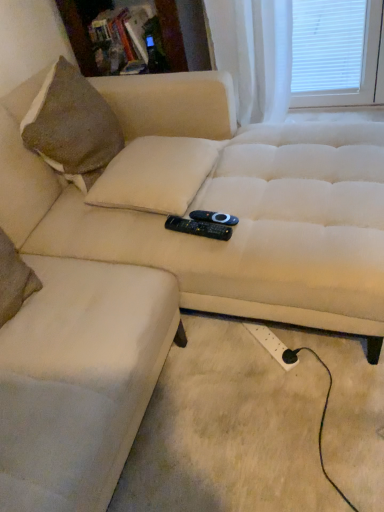
Question: Is black plastic remote at center, the second remote from the top, closer to camera compared to white plastic extension cord at lower right?

Choices:
 (A) yes
 (B) no

Answer: (A)

Question: Is black plastic remote at center, which ranks as the 1th remote in bottom-to-top order, taller than white plastic extension cord at lower right?

Choices:
 (A) yes
 (B) no

Answer: (B)

Question: Is black plastic remote at center, the second remote from the top, looking in the opposite direction of white plastic extension cord at lower right?

Choices:
 (A) no
 (B) yes

Answer: (A)

Question: From the image's perspective, would you say black plastic remote at center, the second remote from the top, is positioned over white plastic extension cord at lower right?

Choices:
 (A) yes
 (B) no

Answer: (A)

Question: Does black plastic remote at center, which ranks as the 1th remote in bottom-to-top order, appear on the right side of white plastic extension cord at lower right?

Choices:
 (A) no
 (B) yes

Answer: (A)

Question: Does black plastic remote at center, which ranks as the 1th remote in bottom-to-top order, have a smaller size compared to white plastic extension cord at lower right?

Choices:
 (A) no
 (B) yes

Answer: (B)

Question: From a real-world perspective, is black plastic remote at center, the 1th remote positioned from the top, physically above white plastic extension cord at lower right?

Choices:
 (A) no
 (B) yes

Answer: (B)

Question: Is black plastic remote at center, the 1th remote positioned from the top, completely or partially outside of white plastic extension cord at lower right?

Choices:
 (A) yes
 (B) no

Answer: (A)

Question: Considering the relative sizes of black plastic remote at center, the 1th remote positioned from the top, and white plastic extension cord at lower right in the image provided, is black plastic remote at center, the 1th remote positioned from the top, shorter than white plastic extension cord at lower right?

Choices:
 (A) no
 (B) yes

Answer: (B)

Question: Are black plastic remote at center, the 2th remote from the bottom, and white plastic extension cord at lower right beside each other?

Choices:
 (A) yes
 (B) no

Answer: (B)

Question: Is black plastic remote at center, the 1th remote positioned from the top, bigger than white plastic extension cord at lower right?

Choices:
 (A) yes
 (B) no

Answer: (B)

Question: Does black plastic remote at center, the 1th remote positioned from the top, have a smaller size compared to white plastic extension cord at lower right?

Choices:
 (A) no
 (B) yes

Answer: (B)

Question: Considering the relative sizes of black plastic remote at center, the 2th remote from the bottom, and black plastic remote at center, the second remote from the top, in the image provided, is black plastic remote at center, the 2th remote from the bottom, bigger than black plastic remote at center, the second remote from the top,?

Choices:
 (A) no
 (B) yes

Answer: (A)